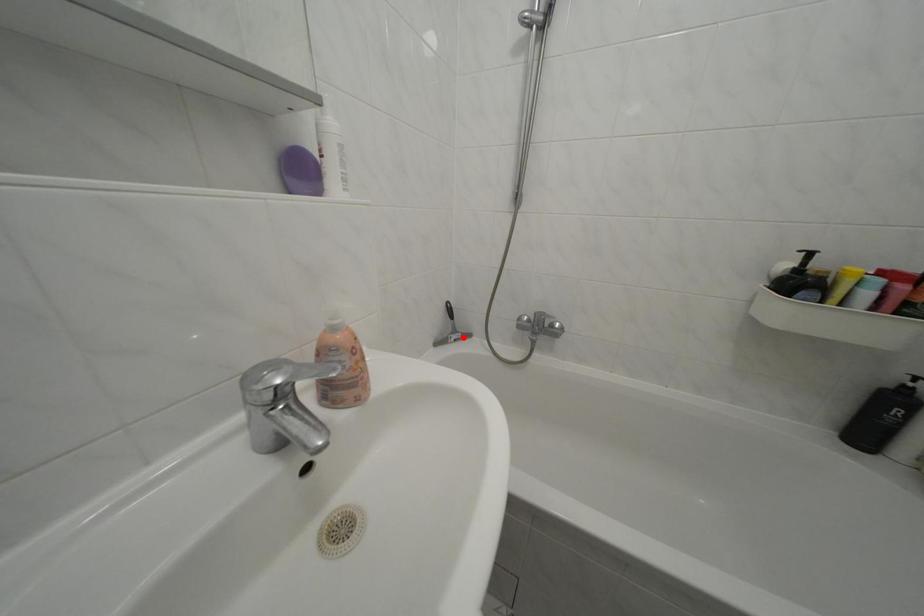
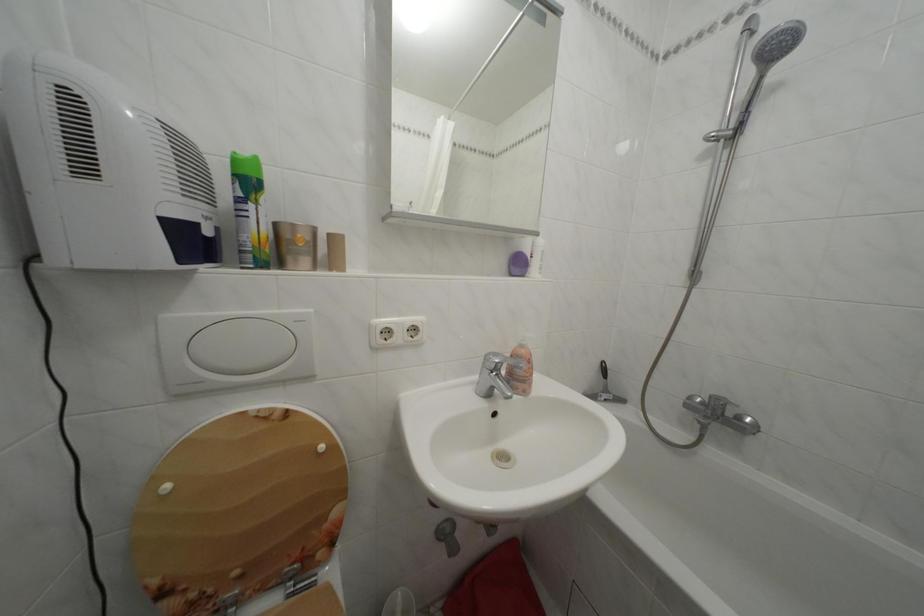
Where in the second image is the point corresponding to the highlighted location from the first image?

(614, 397)